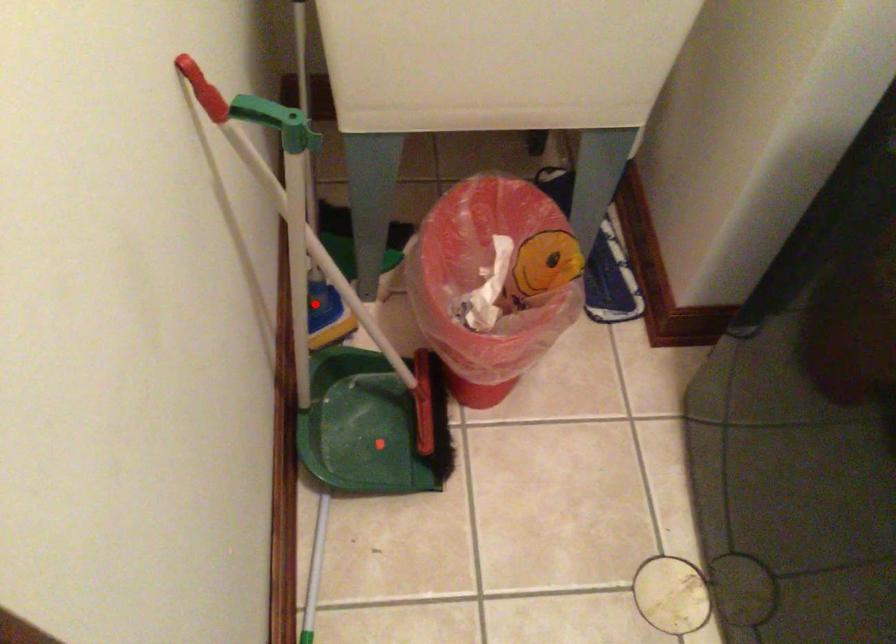
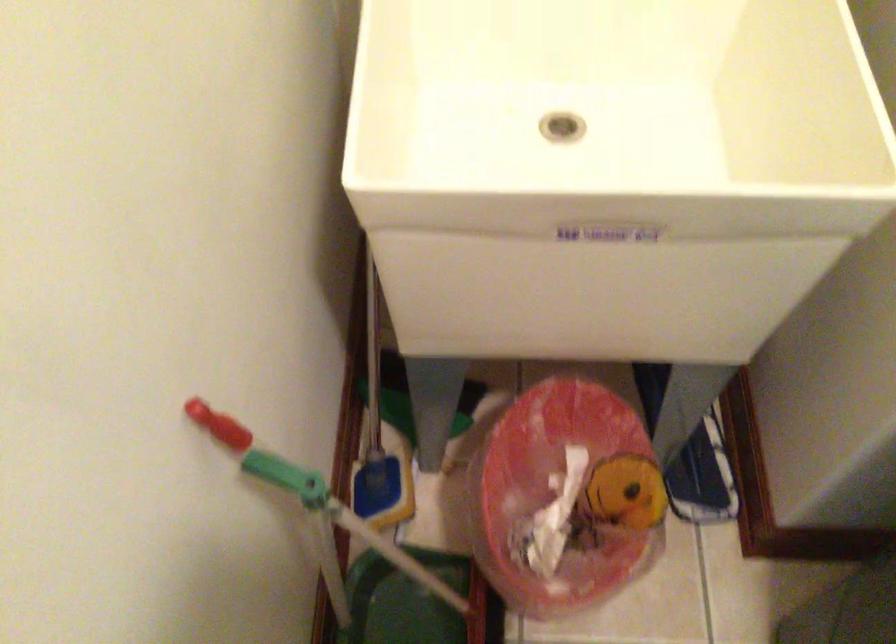
In the second image, find the point that corresponds to the highlighted location in the first image.

(373, 483)